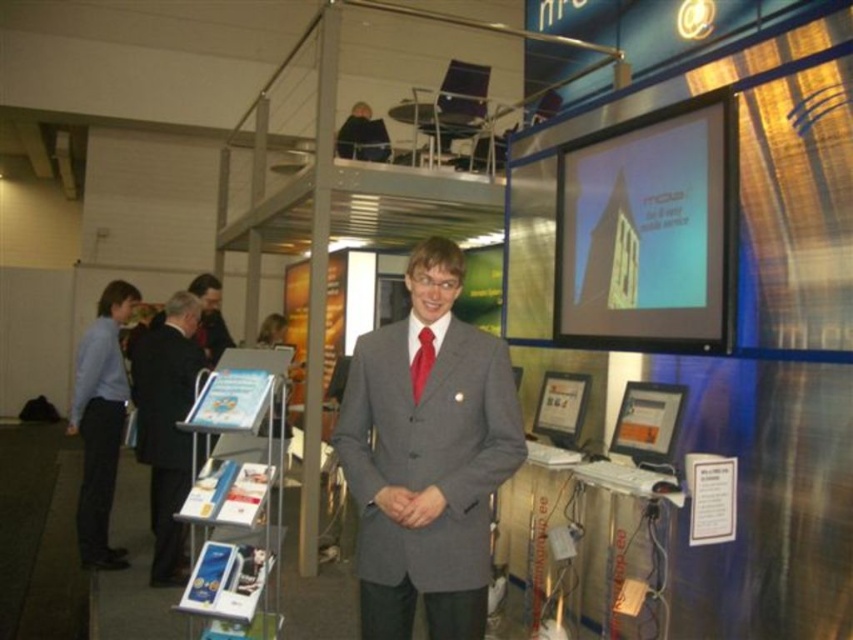
Does blue fabric shirt at left appear under red satin tie at center?

Yes.

How much distance is there between blue fabric shirt at left and red satin tie at center?

blue fabric shirt at left is 3.05 meters from red satin tie at center.

Who is more distant from viewer, (86,467) or (421,356)?

The point (86,467) is more distant.

Find the location of a particular element. Image resolution: width=853 pixels, height=640 pixels. blue fabric shirt at left is located at coordinates (100, 420).

Is gray wool suit at center wider than red satin tie at center?

Yes, gray wool suit at center is wider than red satin tie at center.

Is point (364, 352) behind point (419, 369)?

Yes, it is behind point (419, 369).

Identify the location of gray wool suit at center. Image resolution: width=853 pixels, height=640 pixels. (427, 458).

Which is more to the left, dark gray suit at center or blue fabric shirt at left?

blue fabric shirt at left is more to the left.

Which is above, dark gray suit at center or blue fabric shirt at left?

blue fabric shirt at left is higher up.

The height and width of the screenshot is (640, 853). Find the location of `dark gray suit at center`. dark gray suit at center is located at coordinates (166, 424).